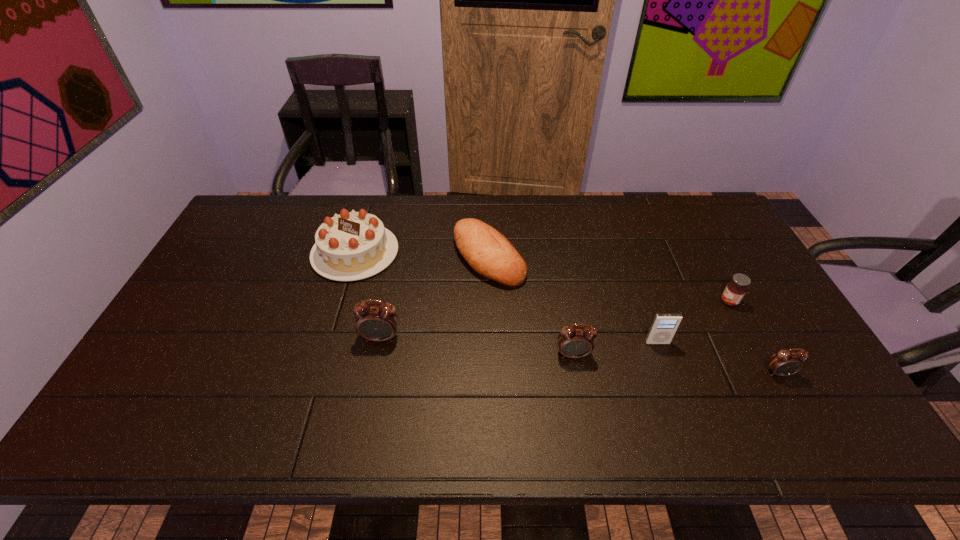
What are the coordinates of `free area in between the nearest alarm clock and the fourth object from right to left` in the screenshot? It's located at (676, 363).

Locate an element on the screen. unoccupied position between the birthday cake and the iPod is located at coordinates (506, 298).

What are the coordinates of `free space between the jam and the nearest alarm clock` in the screenshot? It's located at (754, 337).

At what (x,y) coordinates should I click in order to perform the action: click on free area in between the second alarm clock from left to right and the nearest alarm clock. Please return your answer as a coordinate pair (x, y). The height and width of the screenshot is (540, 960). Looking at the image, I should click on (676, 363).

Identify the location of blank region between the fifth object from left to right and the birthday cake. This screenshot has height=540, width=960. (506, 298).

Where is `free space between the tallest alarm clock and the jam`? The width and height of the screenshot is (960, 540). free space between the tallest alarm clock and the jam is located at coordinates (555, 320).

Where is `vacant space that is in between the birthday cake and the second alarm clock from right to left`? The image size is (960, 540). vacant space that is in between the birthday cake and the second alarm clock from right to left is located at coordinates (464, 303).

Image resolution: width=960 pixels, height=540 pixels. Identify the location of free space that is in between the fifth object from left to right and the fifth object from right to left. (573, 300).

Image resolution: width=960 pixels, height=540 pixels. I want to click on the sixth closest object to the tallest alarm clock, so click(x=786, y=362).

Locate an element on the screen. The height and width of the screenshot is (540, 960). object that ranks as the fifth closest to the second tallest alarm clock is located at coordinates (735, 290).